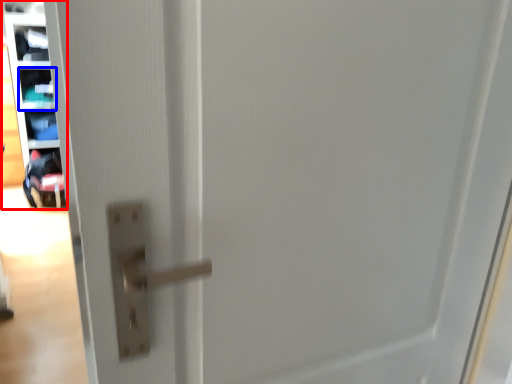
Question: Which point is further to the camera, shelf (highlighted by a red box) or shelf (highlighted by a blue box)?

Choices:
 (A) shelf
 (B) shelf

Answer: (B)